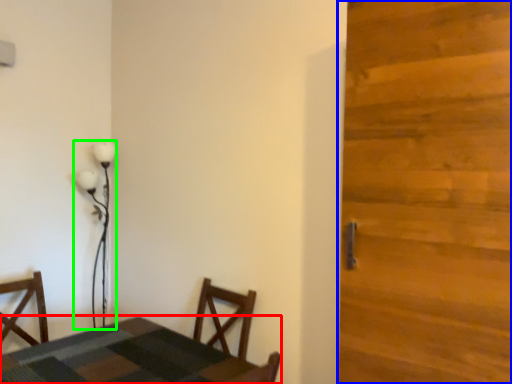
Question: Which object is the farthest from table (highlighted by a red box)? Choose among these: door (highlighted by a blue box) or lamp (highlighted by a green box).

Choices:
 (A) door
 (B) lamp

Answer: (B)